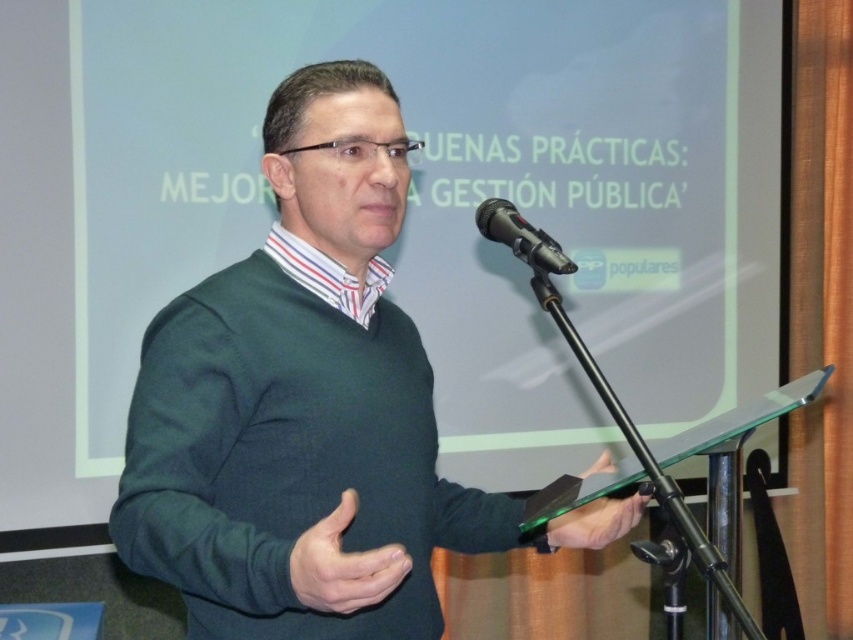
Between green matte sweater at center and black metallic microphone at center, which one is positioned lower?

green matte sweater at center is lower down.

Does green matte sweater at center have a lesser width compared to black metallic microphone at center?

No, green matte sweater at center is not thinner than black metallic microphone at center.

Measure the distance between green matte sweater at center and camera.

They are 33.97 inches apart.

You are a GUI agent. You are given a task and a screenshot of the screen. Output one action in this format:
    pyautogui.click(x=<x>, y=<y>)
    Task: Click on the green matte sweater at center
    The width and height of the screenshot is (853, 640).
    Given the screenshot: What is the action you would take?
    pyautogui.click(x=309, y=406)